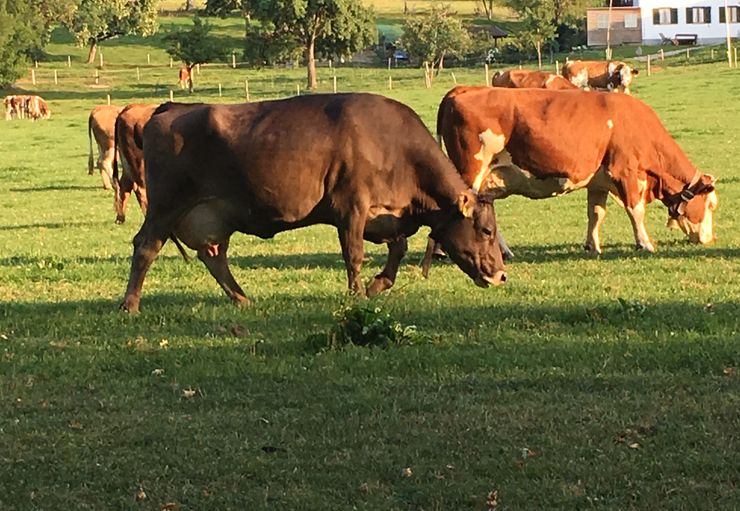
Find the location of a particular element. windows is located at coordinates (661, 10), (690, 13), (730, 9), (599, 22), (630, 21).